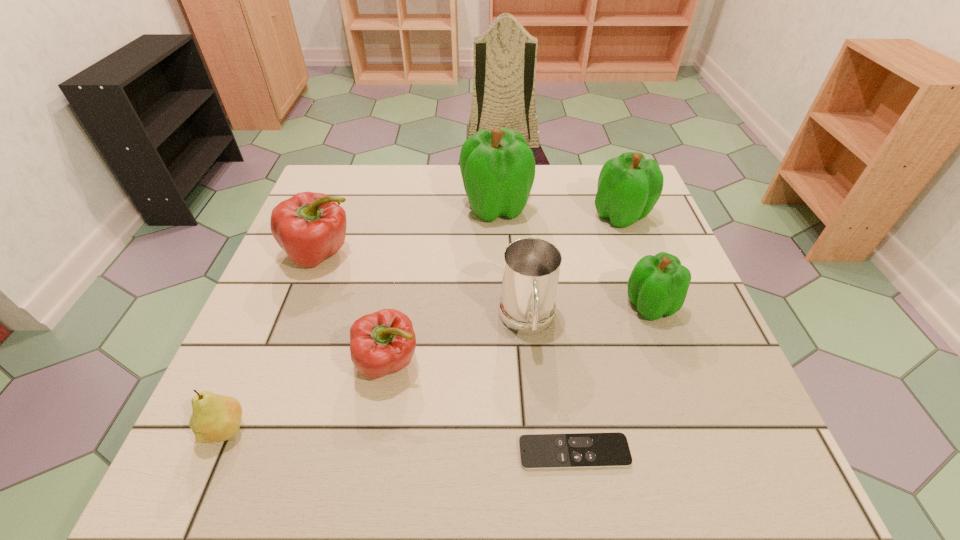
Where is `free space at the right edge of the desktop`? free space at the right edge of the desktop is located at coordinates (656, 251).

In the image, there is a desktop. At what (x,y) coordinates should I click in order to perform the action: click on vacant region at the far left corner. Please return your answer as a coordinate pair (x, y). The height and width of the screenshot is (540, 960). Looking at the image, I should click on (332, 190).

This screenshot has height=540, width=960. What are the coordinates of `vacant region at the near right corner of the desktop` in the screenshot? It's located at tap(771, 454).

Identify the location of free point between the farther pink bell pepper and the fourth farthest bell pepper. (486, 279).

The image size is (960, 540). Identify the location of free space between the farther pink bell pepper and the gray mug. (424, 288).

This screenshot has width=960, height=540. Identify the location of free space that is in between the gray mug and the smallest green bell pepper. point(588,314).

The width and height of the screenshot is (960, 540). Identify the location of free space between the second biggest green bell pepper and the third bell pepper from right to left. (559, 211).

Where is `free spot between the gray mug and the shortest object`? free spot between the gray mug and the shortest object is located at coordinates coord(551,387).

Find the location of a particular element. This screenshot has height=540, width=960. empty location between the nearest green bell pepper and the pear is located at coordinates (438, 367).

I want to click on empty space between the leftmost green bell pepper and the left pink bell pepper, so click(408, 230).